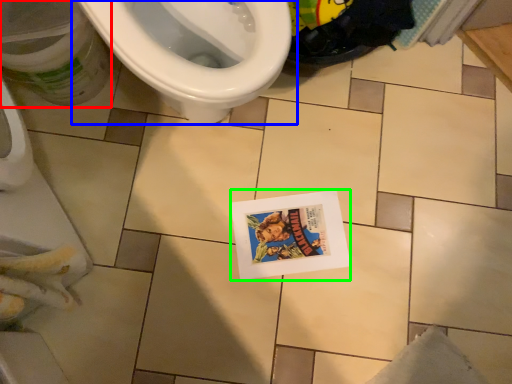
Question: Considering the real-world distances, which object is closest to potty (highlighted by a red box)? toilet (highlighted by a blue box) or comic book (highlighted by a green box).

Choices:
 (A) toilet
 (B) comic book

Answer: (A)